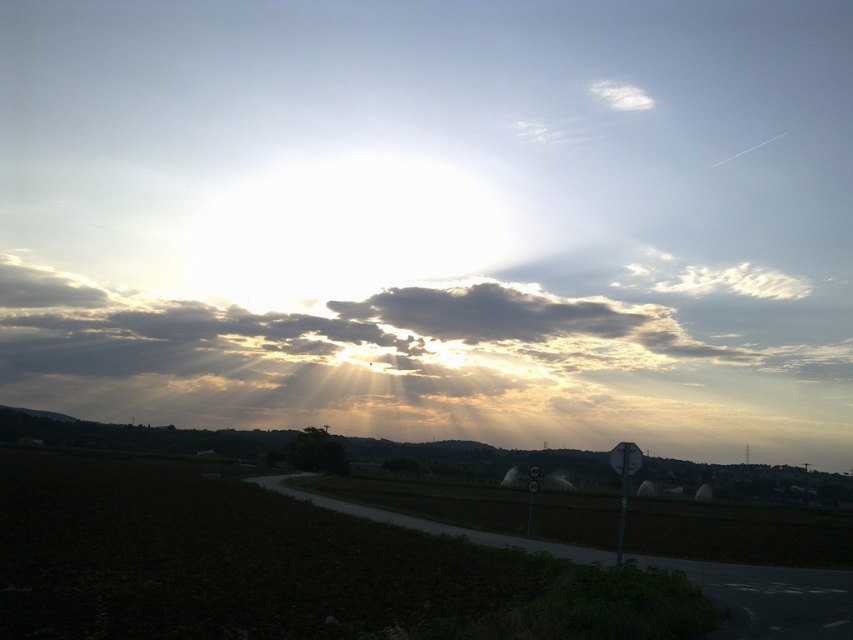
Question: Which point appears closest to the camera in this image?

Choices:
 (A) (537, 470)
 (B) (625, 316)
 (C) (614, 449)

Answer: (C)

Question: Can you confirm if white plastic sign at right is bigger than metallic reflective speed limit sign at lower right?

Choices:
 (A) yes
 (B) no

Answer: (A)

Question: Which of the following is the closest to the observer?

Choices:
 (A) (619, 472)
 (B) (534, 314)
 (C) (531, 500)

Answer: (A)

Question: Is white plastic sign at right thinner than metallic reflective speed limit sign at lower right?

Choices:
 (A) no
 (B) yes

Answer: (A)

Question: Can you confirm if cloudy at upper center is wider than metallic reflective speed limit sign at lower right?

Choices:
 (A) yes
 (B) no

Answer: (A)

Question: Which object is closer to the camera taking this photo?

Choices:
 (A) white plastic sign at right
 (B) cloudy at upper center
 (C) metallic reflective speed limit sign at lower right

Answer: (A)